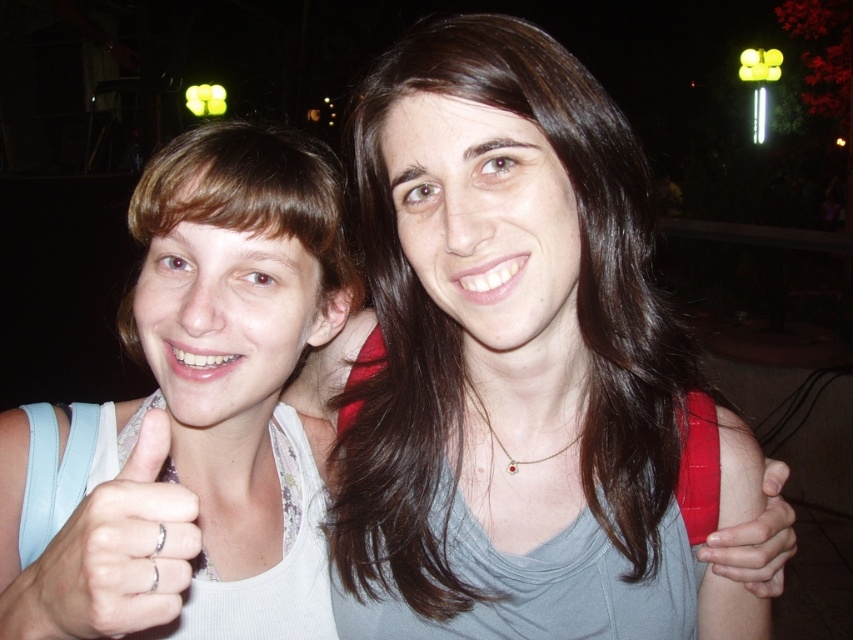
Is dark brown hair at center to the right of silver metallic ring at lower left from the viewer's perspective?

Correct, you'll find dark brown hair at center to the right of silver metallic ring at lower left.

Who is lower down, dark brown hair at center or silver metallic ring at lower left?

silver metallic ring at lower left

Is point (490, 102) behind point (183, 493)?

That is True.

At what (x,y) coordinates should I click in order to perform the action: click on dark brown hair at center. Please return your answer as a coordinate pair (x, y). Looking at the image, I should click on (459, 332).

Can you confirm if white fabric shirt at left is positioned to the left of silver metallic ring at lower left?

In fact, white fabric shirt at left is to the right of silver metallic ring at lower left.

Measure the distance from white fabric shirt at left to silver metallic ring at lower left.

white fabric shirt at left is 10.49 centimeters from silver metallic ring at lower left.

Is point (177, 396) closer to viewer compared to point (173, 492)?

That is False.

At what (x,y) coordinates should I click in order to perform the action: click on white fabric shirt at left. Please return your answer as a coordinate pair (x, y). The height and width of the screenshot is (640, 853). Looking at the image, I should click on (202, 404).

Between white fabric shirt at left and dark brown hair at center, which one appears on the left side from the viewer's perspective?

white fabric shirt at left is more to the left.

Can you confirm if white fabric shirt at left is positioned above dark brown hair at center?

No, white fabric shirt at left is not above dark brown hair at center.

Is point (138, 298) closer to viewer compared to point (579, 291)?

No, it is behind (579, 291).

I want to click on white fabric shirt at left, so click(x=202, y=404).